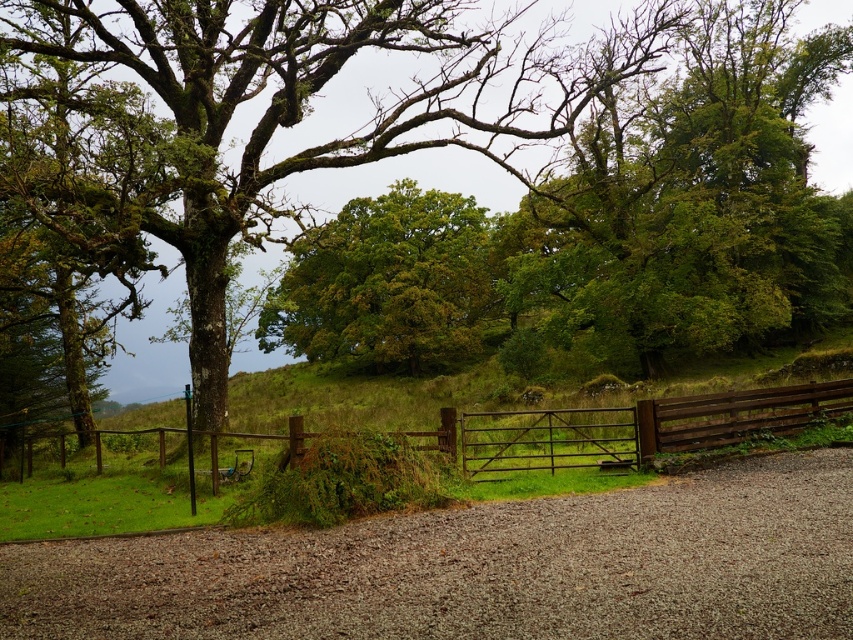
Does green mossy tree at center lie behind brown wooden gate at center?

Yes, green mossy tree at center is behind brown wooden gate at center.

Does green mossy tree at center have a greater height compared to brown wooden gate at center?

Indeed, green mossy tree at center has a greater height compared to brown wooden gate at center.

Between point (195, 104) and point (850, 381), which one is positioned in front?

Point (850, 381) is in front.

This screenshot has height=640, width=853. In order to click on green mossy tree at center in this screenshot , I will do `click(308, 108)`.

Is green leafy tree at center to the right of brown wooden gate at center from the viewer's perspective?

Incorrect, green leafy tree at center is not on the right side of brown wooden gate at center.

Is green leafy tree at center in front of brown wooden gate at center?

No, it is behind brown wooden gate at center.

Locate an element on the screen. Image resolution: width=853 pixels, height=640 pixels. green leafy tree at center is located at coordinates (386, 284).

Identify the location of green leafy tree at center. (386, 284).

Between point (712, 536) and point (421, 141), which one is positioned behind?

Point (421, 141)

Between gravelly path at center and green mossy tree at center, which one appears on the left side from the viewer's perspective?

From the viewer's perspective, green mossy tree at center appears more on the left side.

Which is behind, point (741, 515) or point (289, 65)?

The point (289, 65) is more distant.

Find the location of a particular element. The height and width of the screenshot is (640, 853). gravelly path at center is located at coordinates (480, 568).